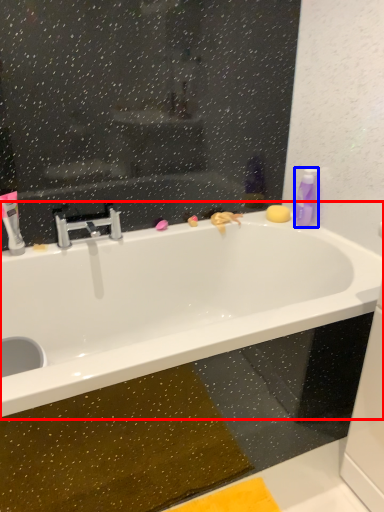
Question: Which object appears farthest to the camera in this image, bathtub (highlighted by a red box) or cleaning product (highlighted by a blue box)?

Choices:
 (A) bathtub
 (B) cleaning product

Answer: (B)